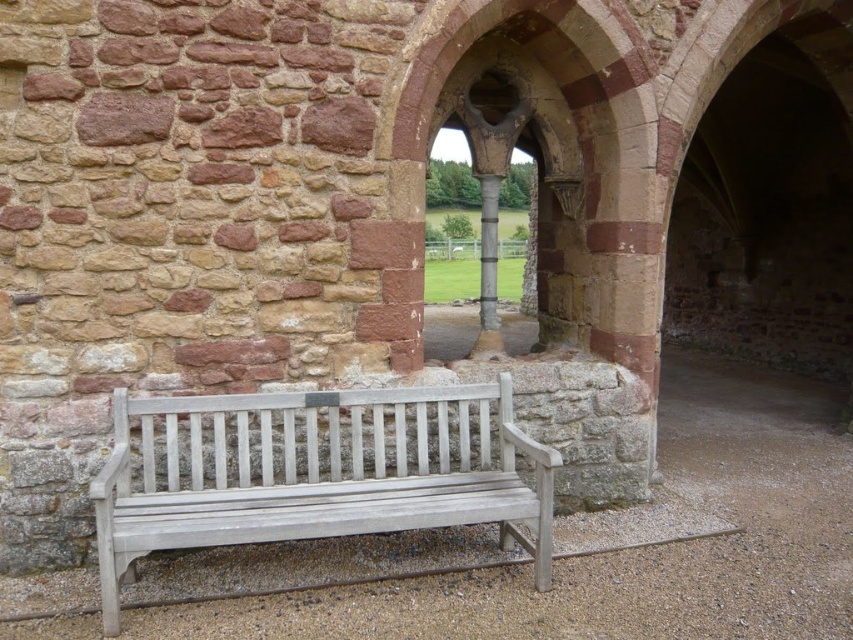
Is white wood bench at center to the left of smooth gray stone pillar at center from the viewer's perspective?

Indeed, white wood bench at center is positioned on the left side of smooth gray stone pillar at center.

Does white wood bench at center have a lesser width compared to smooth gray stone pillar at center?

In fact, white wood bench at center might be wider than smooth gray stone pillar at center.

Image resolution: width=853 pixels, height=640 pixels. Describe the element at coordinates (316, 476) in the screenshot. I see `white wood bench at center` at that location.

Image resolution: width=853 pixels, height=640 pixels. Find the location of `white wood bench at center`. white wood bench at center is located at coordinates (316, 476).